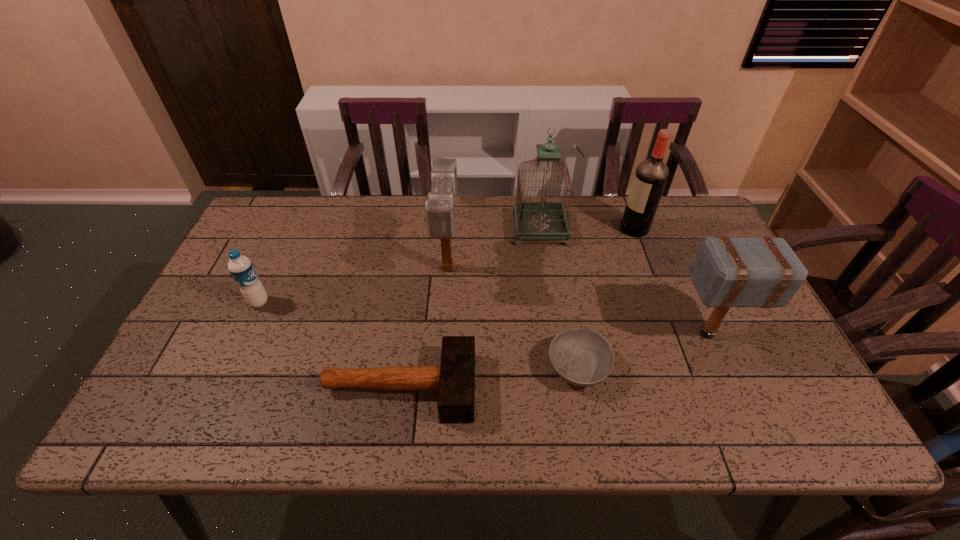
You are a GUI agent. You are given a task and a screenshot of the screen. Output one action in this format:
    pyautogui.click(x=<x>, y=<y>)
    Task: Click on the free spot located on the back of the shortest object
    
    Given the screenshot: What is the action you would take?
    555,239

Find the location of a particular element. This screenshot has height=540, width=960. birdcage that is at the far edge is located at coordinates (542, 220).

Locate an element on the screen. The image size is (960, 540). liquor that is positioned at the far edge is located at coordinates (651, 175).

This screenshot has height=540, width=960. Identify the location of mallet that is at the far edge. (439, 208).

Identify the location of object that is positioned at the near edge. The height and width of the screenshot is (540, 960). (454, 379).

At what (x,y) coordinates should I click in order to perform the action: click on object that is at the left edge. Please return your answer as a coordinate pair (x, y). The image size is (960, 540). Looking at the image, I should click on (241, 268).

You are a GUI agent. You are given a task and a screenshot of the screen. Output one action in this format:
    pyautogui.click(x=<x>, y=<y>)
    Task: Click on the object positioned at the right edge
    Image resolution: width=960 pixels, height=540 pixels.
    Given the screenshot: What is the action you would take?
    pyautogui.click(x=764, y=272)

In the image, there is a desktop. At what (x,y) coordinates should I click in order to perform the action: click on vacant space at the far edge. Please return your answer as a coordinate pair (x, y). The image size is (960, 540). Looking at the image, I should click on (612, 234).

Identify the location of vacant space at the near edge of the desktop. (555, 440).

Find the location of a particular element. vacant area at the left edge of the desktop is located at coordinates (276, 256).